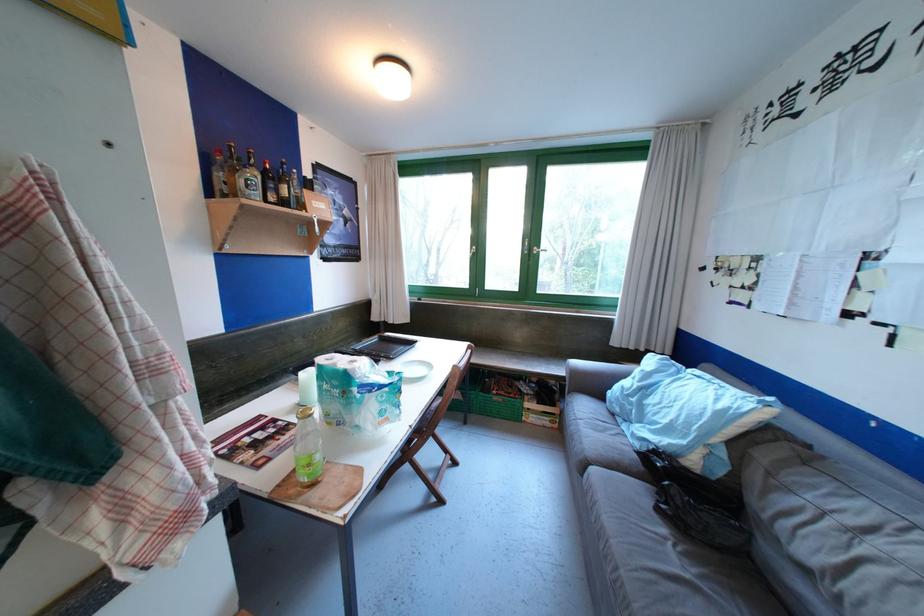
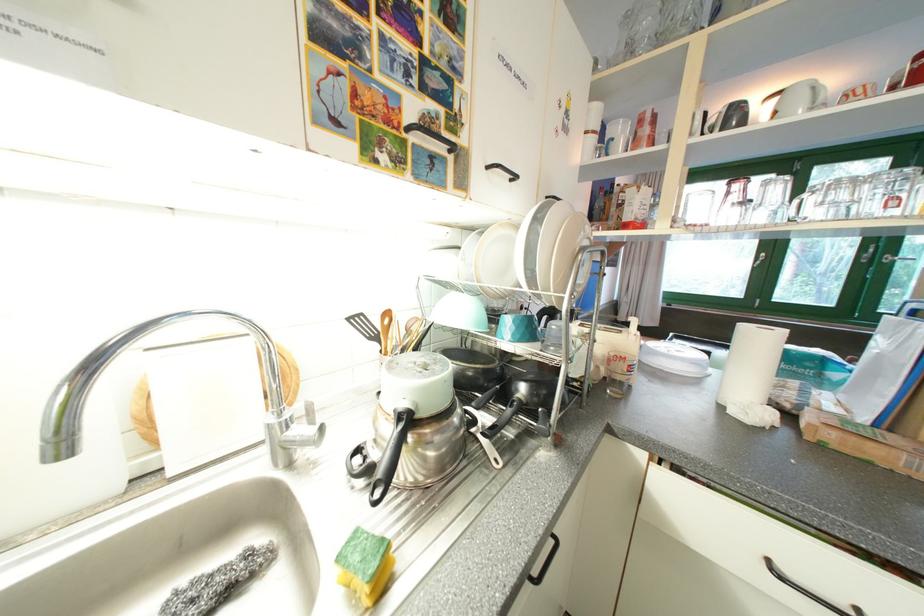
What movement of the cameraman would produce the second image?

The movement direction of the cameraman is left, backward.